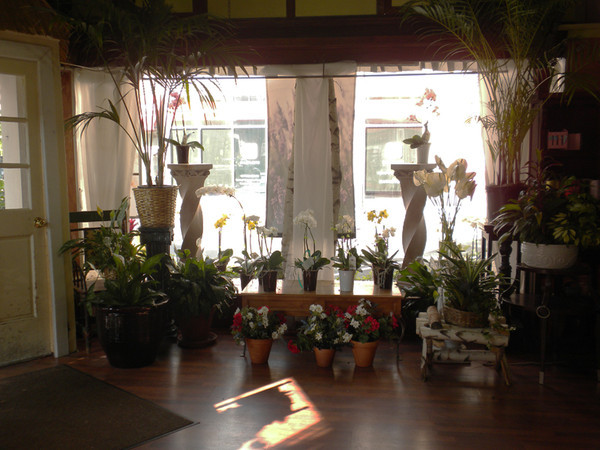
Identify the location of door knob. (43, 221).